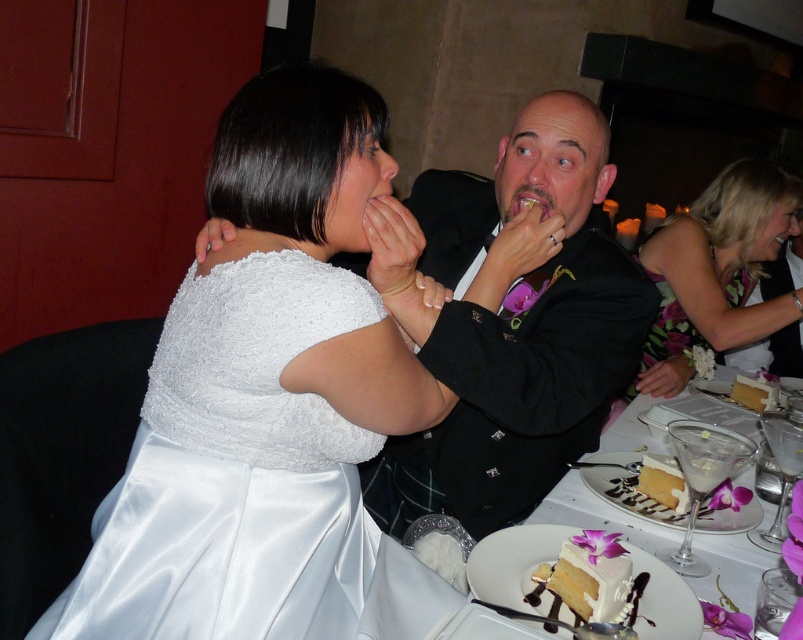
You are a photographer at the wedding reception and need to capture a photo of the floral dress at right and the white frosted cake at lower right. Based on their heights, which object should you focus on first to ensure both are in frame?

The floral dress at right is taller than the white frosted cake at lower right, so you should focus on the floral dress at right first to ensure both are in frame.

You are a photographer at the wedding reception. You want to capture a closeup shot of the bride in the white wedding dress. The camera you are using has a focus point at coordinate point (261, 394). Is the focus point positioned correctly to capture the bride?

The satin white dress at upper left is located at point (261, 394), so yes, the focus point is positioned correctly to capture the bride in the satin white dress at upper left.

Looking at this image, you are standing at the reception and want to take a photo of the point at coordinates point (x=730, y=209). If your camera has a focal length of 50mm and you want to capture the entire scene within a 3m width, will you need to move closer or farther away?

The distance between the viewer and point (x=730, y=209) is 2.30 meters. Since the camera can capture a 3m width at this distance, you do not need to adjust your position.